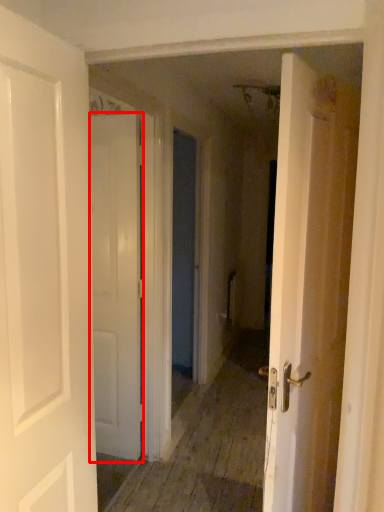
Question: From the image's perspective, what is the correct spatial positioning of door (annotated by the red box) in reference to door?

Choices:
 (A) below
 (B) above

Answer: (A)